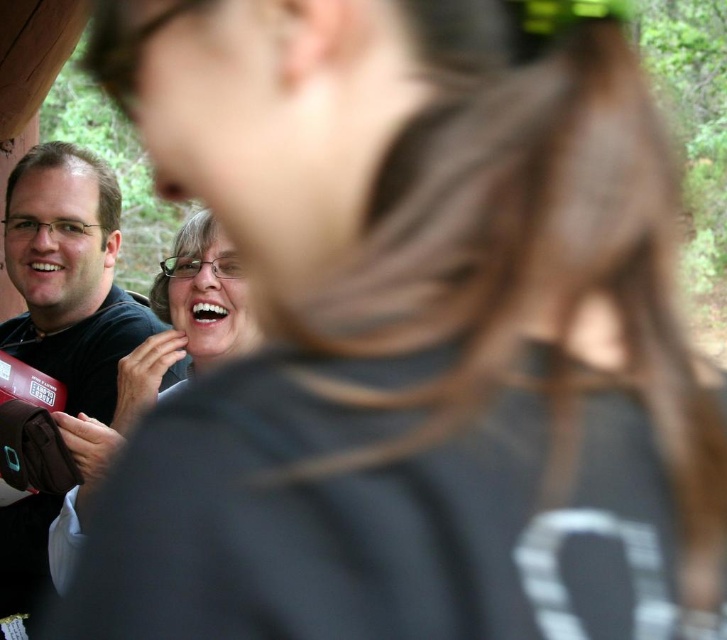
Who is positioned more to the left, matte black shirt at left or matte black shirt at center?

matte black shirt at left

Between point (68, 150) and point (236, 300), which one is positioned behind?

Positioned behind is point (68, 150).

Is point (76, 269) in front of point (76, 554)?

No, it is behind (76, 554).

Locate an element on the screen. matte black shirt at left is located at coordinates (68, 275).